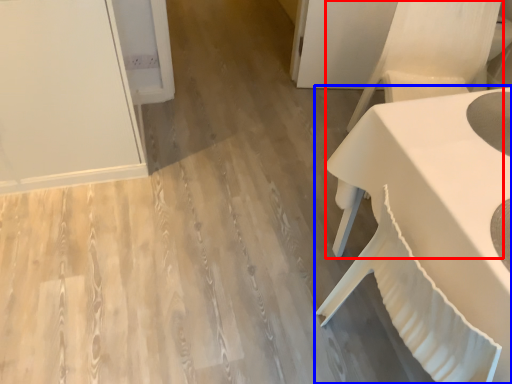
Question: Which of the following is the closest to the observer, armchair (highlighted by a red box) or table (highlighted by a blue box)?

Choices:
 (A) armchair
 (B) table

Answer: (B)